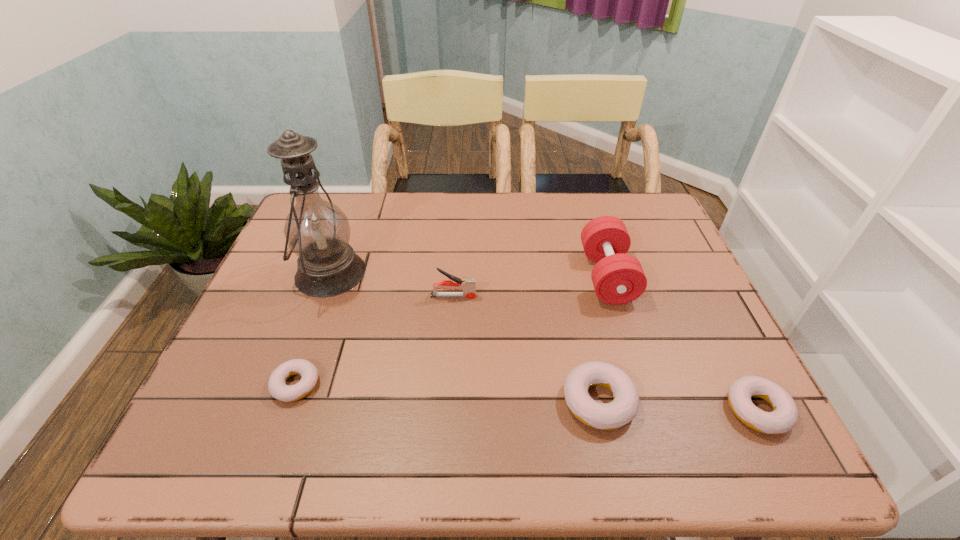
Identify the location of free location located 0.140m on the left of the leftmost doughnut. The width and height of the screenshot is (960, 540). (206, 384).

Identify the location of free region located 0.060m on the left of the tallest doughnut. Image resolution: width=960 pixels, height=540 pixels. (533, 401).

Find the location of a particular element. The width and height of the screenshot is (960, 540). free space located on the back of the rightmost object is located at coordinates (711, 320).

Identify the location of blank space located 0.170m on the handle side of the fourth shortest object. (542, 296).

The image size is (960, 540). Identify the location of free space located on the front of the second tallest object. (628, 343).

Where is `vacant space positioned 0.090m on the right of the oil lamp`? The height and width of the screenshot is (540, 960). vacant space positioned 0.090m on the right of the oil lamp is located at coordinates (398, 273).

Locate an element on the screen. doughnut situated at the left edge is located at coordinates (277, 386).

What are the coordinates of `oil lamp that is at the left edge` in the screenshot? It's located at [317, 231].

You are a GUI agent. You are given a task and a screenshot of the screen. Output one action in this format:
    pyautogui.click(x=<x>, y=<y>)
    Task: Click on the object that is at the right edge
    
    Given the screenshot: What is the action you would take?
    pyautogui.click(x=784, y=416)

I want to click on object located in the near left corner section of the desktop, so click(277, 386).